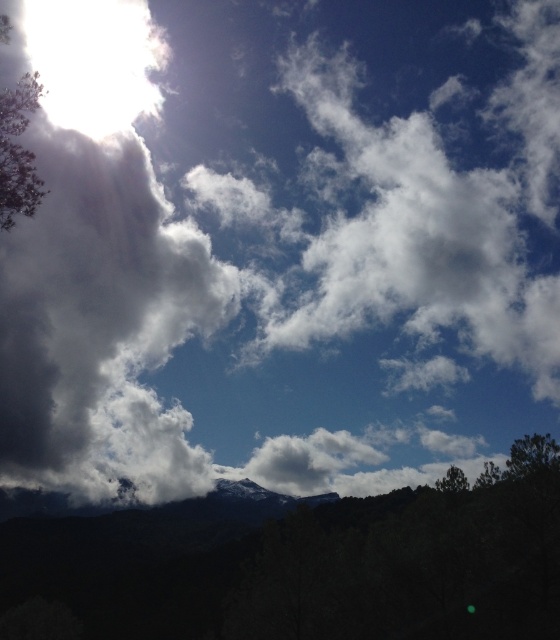
Is the position of green leafy tree at upper left more distant than that of green matte tree at lower right?

No, it is in front of green matte tree at lower right.

Who is lower down, green leafy tree at upper left or green matte tree at lower right?

Positioned lower is green matte tree at lower right.

Is point (25, 122) farther from camera compared to point (460, 490)?

That is False.

This screenshot has height=640, width=560. I want to click on green leafy tree at upper left, so click(17, 150).